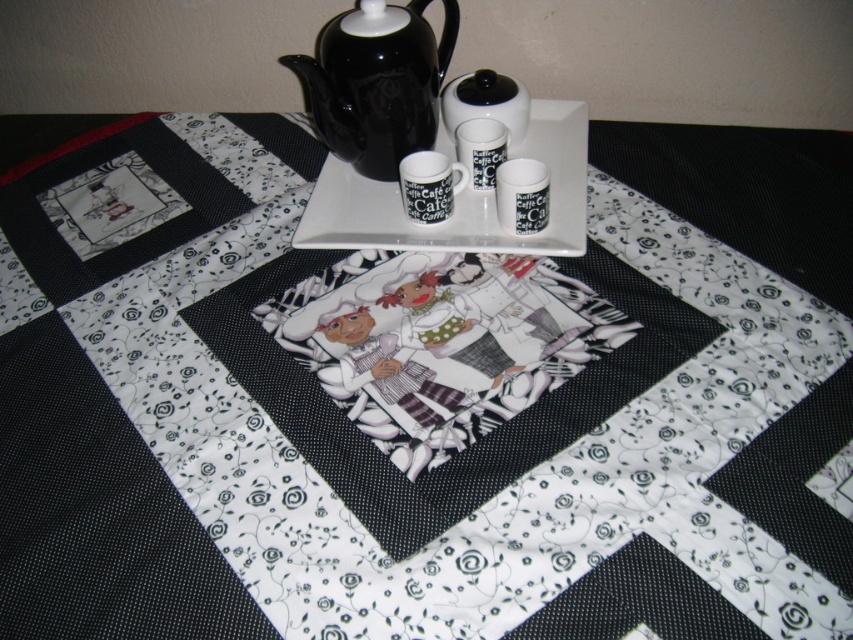
Is point (451, 17) positioned before point (316, 189)?

No, (451, 17) is behind (316, 189).

Who is shorter, black ceramic teapot at upper center or white glossy platter at upper center?

white glossy platter at upper center

Which is behind, point (347, 120) or point (583, 122)?

Positioned behind is point (583, 122).

At what (x,y) coordinates should I click in order to perform the action: click on black ceramic teapot at upper center. Please return your answer as a coordinate pair (x, y). The height and width of the screenshot is (640, 853). Looking at the image, I should click on (376, 83).